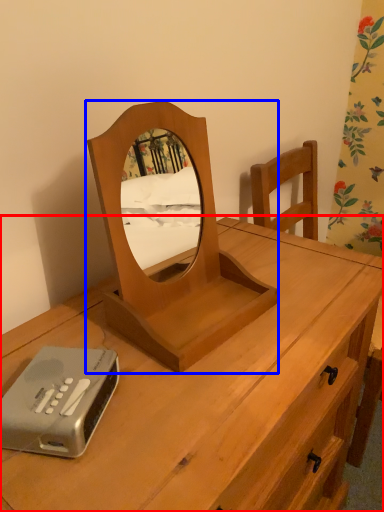
Question: Which point is further to the camera, desk (highlighted by a red box) or mirror (highlighted by a blue box)?

Choices:
 (A) desk
 (B) mirror

Answer: (B)